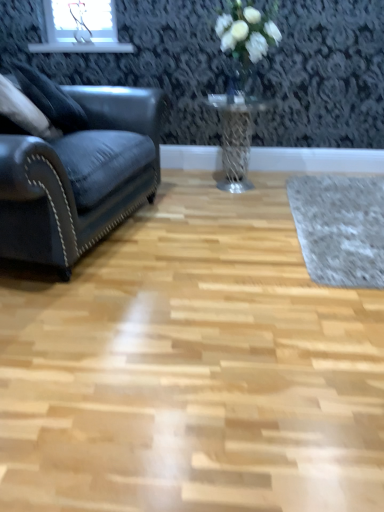
Identify the location of free space on the front side of metallic mesh table at center. Image resolution: width=384 pixels, height=512 pixels. (231, 211).